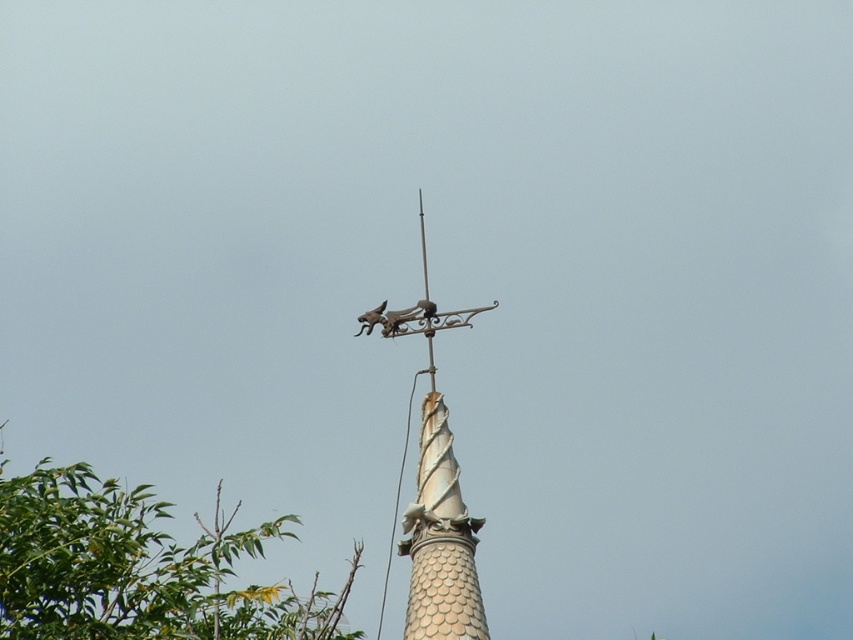
In the scene shown: Is green leafy tree at upper left bigger than metallic weather vane at center?

Correct, green leafy tree at upper left is larger in size than metallic weather vane at center.

Which is in front, point (144, 577) or point (450, 580)?

Point (450, 580) is in front.

Locate an element on the screen. Image resolution: width=853 pixels, height=640 pixels. green leafy tree at upper left is located at coordinates (138, 568).

Is metallic weather vane at center thinner than metallic gray bird at top?

No, metallic weather vane at center is not thinner than metallic gray bird at top.

Is point (410, 598) positioned behind point (358, 328)?

No, it is in front of (358, 328).

Where is `metallic weather vane at center`? This screenshot has height=640, width=853. metallic weather vane at center is located at coordinates (437, 497).

Does green leafy tree at upper left have a lesser width compared to metallic gray bird at top?

No.

Which is in front, point (28, 499) or point (358, 320)?

Point (28, 499) is more forward.

Locate an element on the screen. This screenshot has height=640, width=853. green leafy tree at upper left is located at coordinates (138, 568).